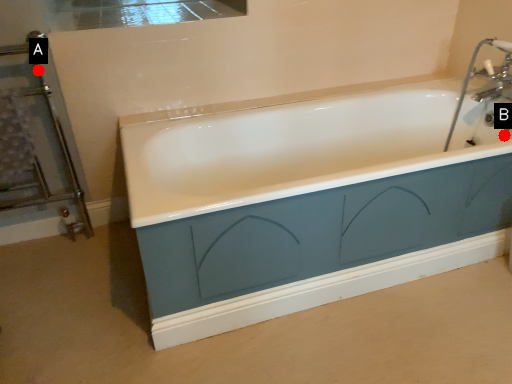
Question: Two points are circled on the image, labeled by A and B beside each circle. Which point appears farthest from the camera in this image?

Choices:
 (A) A is further
 (B) B is further

Answer: (B)